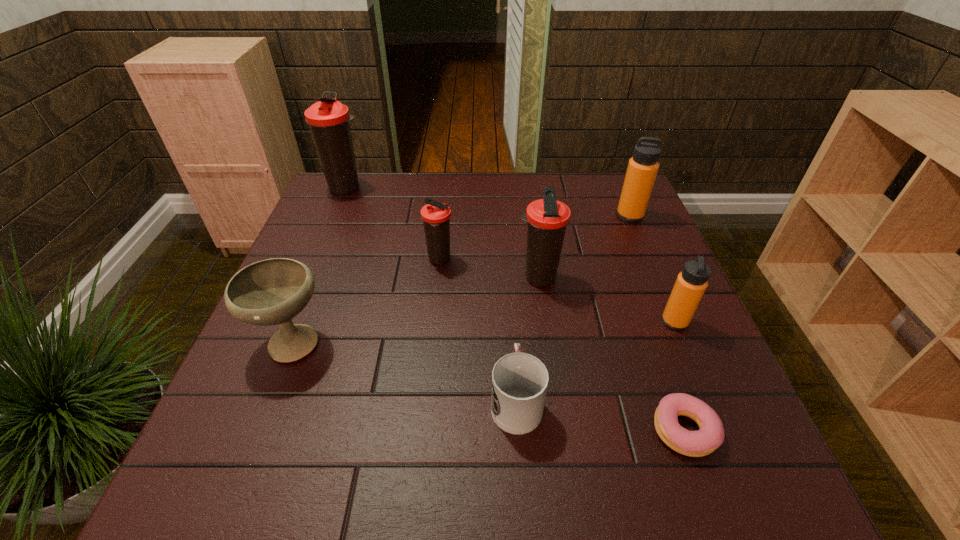
Where is `vacant space that is in between the cup and the chalice`? vacant space that is in between the cup and the chalice is located at coordinates (404, 370).

Locate an element on the screen. The width and height of the screenshot is (960, 540). vacant region between the nearer orange thermos bottle and the cup is located at coordinates (595, 361).

Where is `empty space that is in between the second shortest object and the chalice`? This screenshot has height=540, width=960. empty space that is in between the second shortest object and the chalice is located at coordinates (404, 370).

Identify the location of vacant area that lies between the nearest thermos bottle and the smallest brown thermos bottle. (558, 291).

I want to click on blank region between the smallest brown thermos bottle and the pink doughnut, so click(x=562, y=345).

Find the location of a particular element. free spot between the doughnut and the nearer orange thermos bottle is located at coordinates (680, 375).

You are a GUI agent. You are given a task and a screenshot of the screen. Output one action in this format:
    pyautogui.click(x=<x>, y=<y>)
    Task: Click on the vacant space in between the chalice and the third object from left to right
    
    Given the screenshot: What is the action you would take?
    pyautogui.click(x=367, y=300)

Where is `free area in between the seventh tallest object and the chalice`? The height and width of the screenshot is (540, 960). free area in between the seventh tallest object and the chalice is located at coordinates (404, 370).

Select which object appears as the second closest to the second shortest object. Please provide its 2D coordinates. Your answer should be formatted as a tuple, i.e. [(x, y)], where the tuple contains the x and y coordinates of a point satisfying the conditions above.

[(547, 218)]

Select which object appears as the sixth closest to the bigger orange thermos bottle. Please provide its 2D coordinates. Your answer should be formatted as a tuple, i.e. [(x, y)], where the tuple contains the x and y coordinates of a point satisfying the conditions above.

[(328, 119)]